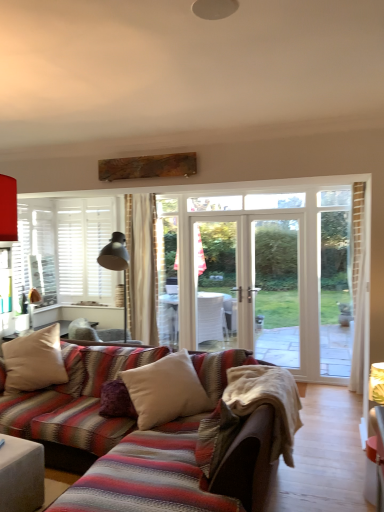
Image resolution: width=384 pixels, height=512 pixels. What do you see at coordinates (34, 361) in the screenshot? I see `beige fabric pillow at lower left, the third pillow from the right` at bounding box center [34, 361].

The width and height of the screenshot is (384, 512). What do you see at coordinates (116, 400) in the screenshot?
I see `velvet purple pillow at center, positioned as the second pillow in right-to-left order` at bounding box center [116, 400].

Measure the distance between white soft cushion at center, which ranks as the first pillow in right-to-left order, and camera.

They are 9.70 feet apart.

Identify the location of beige fabric pillow at lower left, the third pillow from the right. Image resolution: width=384 pixels, height=512 pixels. (34, 361).

Based on the photo, considering the positions of objects white soft cushion at center, which ranks as the first pillow in right-to-left order, and beige fabric pillow at lower left, which appears as the 1th pillow when viewed from the left, in the image provided, who is behind, white soft cushion at center, which ranks as the first pillow in right-to-left order, or beige fabric pillow at lower left, which appears as the 1th pillow when viewed from the left,?

beige fabric pillow at lower left, which appears as the 1th pillow when viewed from the left.

Which is more to the left, white soft cushion at center, the third pillow from the left, or beige fabric pillow at lower left, which appears as the 1th pillow when viewed from the left?

From the viewer's perspective, beige fabric pillow at lower left, which appears as the 1th pillow when viewed from the left, appears more on the left side.

Between point (191, 402) and point (44, 384), which one is positioned in front?

The point (191, 402) is closer.

How far apart are white soft cushion at center, the third pillow from the left, and beige fabric pillow at lower left, the third pillow from the right?

The distance of white soft cushion at center, the third pillow from the left, from beige fabric pillow at lower left, the third pillow from the right, is 1.06 meters.

Which of these two, velvet purple pillow at center, the second pillow when ordered from left to right, or beige cotton blanket at lower center, stands shorter?

With less height is velvet purple pillow at center, the second pillow when ordered from left to right.

Is velvet purple pillow at center, the second pillow when ordered from left to right, closer to camera compared to beige cotton blanket at lower center?

That is False.

Starting from the beige cotton blanket at lower center, which pillow is the 2nd one to the left? Please provide its 2D coordinates.

[(116, 400)]

From a real-world perspective, is velvet purple pillow at center, the second pillow when ordered from left to right, above or below beige cotton blanket at lower center?

velvet purple pillow at center, the second pillow when ordered from left to right, is below beige cotton blanket at lower center.

Which is in front, beige fabric pillow at lower left, which appears as the 1th pillow when viewed from the left, or white soft cushion at center, the third pillow from the left?

white soft cushion at center, the third pillow from the left.

Is beige fabric pillow at lower left, which appears as the 1th pillow when viewed from the left, spatially inside white soft cushion at center, the third pillow from the left, or outside of it?

beige fabric pillow at lower left, which appears as the 1th pillow when viewed from the left, lies outside white soft cushion at center, the third pillow from the left.

Between point (49, 358) and point (147, 416), which one is positioned in front?

The point (147, 416) is closer.

Is beige fabric pillow at lower left, the third pillow from the right, taller than white soft cushion at center, which ranks as the first pillow in right-to-left order?

Yes, beige fabric pillow at lower left, the third pillow from the right, is taller than white soft cushion at center, which ranks as the first pillow in right-to-left order.

Is the depth of beige fabric pillow at lower left, which appears as the 1th pillow when viewed from the left, less than that of velvet purple pillow at center, positioned as the second pillow in right-to-left order?

No, the depth of beige fabric pillow at lower left, which appears as the 1th pillow when viewed from the left, is greater than that of velvet purple pillow at center, positioned as the second pillow in right-to-left order.

Would you say beige fabric pillow at lower left, which appears as the 1th pillow when viewed from the left, is a long distance from velvet purple pillow at center, positioned as the second pillow in right-to-left order?

No, beige fabric pillow at lower left, which appears as the 1th pillow when viewed from the left, is not far from velvet purple pillow at center, positioned as the second pillow in right-to-left order.

Looking at this image, considering the sizes of objects beige fabric pillow at lower left, which appears as the 1th pillow when viewed from the left, and velvet purple pillow at center, positioned as the second pillow in right-to-left order, in the image provided, who is bigger, beige fabric pillow at lower left, which appears as the 1th pillow when viewed from the left, or velvet purple pillow at center, positioned as the second pillow in right-to-left order,?

beige fabric pillow at lower left, which appears as the 1th pillow when viewed from the left.

In order to click on the 2nd pillow positioned below the beige fabric pillow at lower left, which appears as the 1th pillow when viewed from the left (from the image's perspective) in this screenshot , I will do `click(116, 400)`.

Consider the image. From a real-world perspective, is beige cotton blanket at lower center below velvet purple pillow at center, positioned as the second pillow in right-to-left order?

No.

Is point (249, 379) closer to viewer compared to point (120, 405)?

Yes.

Which is correct: beige cotton blanket at lower center is inside velvet purple pillow at center, positioned as the second pillow in right-to-left order, or outside of it?

beige cotton blanket at lower center cannot be found inside velvet purple pillow at center, positioned as the second pillow in right-to-left order.

How different are the orientations of beige cotton blanket at lower center and velvet purple pillow at center, positioned as the second pillow in right-to-left order, in degrees?

beige cotton blanket at lower center and velvet purple pillow at center, positioned as the second pillow in right-to-left order, are facing 114 degrees away from each other.

Is beige cotton blanket at lower center completely or partially outside of beige fabric pillow at lower left, which appears as the 1th pillow when viewed from the left?

beige cotton blanket at lower center lies outside beige fabric pillow at lower left, which appears as the 1th pillow when viewed from the left,'s area.

Find the location of a particular element. blanket below the beige fabric pillow at lower left, the third pillow from the right (from the image's perspective) is located at coordinates (250, 413).

Which is closer, (247, 370) or (39, 374)?

Point (247, 370)

Considering the relative sizes of beige cotton blanket at lower center and beige fabric pillow at lower left, the third pillow from the right, in the image provided, is beige cotton blanket at lower center taller than beige fabric pillow at lower left, the third pillow from the right,?

Incorrect, the height of beige cotton blanket at lower center is not larger of that of beige fabric pillow at lower left, the third pillow from the right.

Do you think white soft cushion at center, the third pillow from the left, is within beige cotton blanket at lower center, or outside of it?

white soft cushion at center, the third pillow from the left, is located beyond the bounds of beige cotton blanket at lower center.

Which object is positioned more to the left, white soft cushion at center, which ranks as the first pillow in right-to-left order, or beige cotton blanket at lower center?

white soft cushion at center, which ranks as the first pillow in right-to-left order, is more to the left.

From a real-world perspective, is white soft cushion at center, the third pillow from the left, physically above beige cotton blanket at lower center?

Indeed, from a real-world perspective, white soft cushion at center, the third pillow from the left, stands above beige cotton blanket at lower center.

Looking at this image, which object is more forward, white soft cushion at center, the third pillow from the left, or beige cotton blanket at lower center?

beige cotton blanket at lower center.

Where is `pillow that is the 2nd object to the right of the beige fabric pillow at lower left, which appears as the 1th pillow when viewed from the left, starting at the anchor`? The height and width of the screenshot is (512, 384). pillow that is the 2nd object to the right of the beige fabric pillow at lower left, which appears as the 1th pillow when viewed from the left, starting at the anchor is located at coordinates (165, 390).

Locate an element on the screen. pillow below the beige cotton blanket at lower center (from the image's perspective) is located at coordinates coord(116,400).

Considering their positions, is matte gray ottoman at lower left positioned closer to velvet purple pillow at center, positioned as the second pillow in right-to-left order, than white soft cushion at center, the third pillow from the left?

white soft cushion at center, the third pillow from the left.

Looking at the image, which one is located further to matte gray ottoman at lower left, beige fabric pillow at lower left, the third pillow from the right, or white soft cushion at center, the third pillow from the left?

beige fabric pillow at lower left, the third pillow from the right.

Consider the image. Considering their positions, is beige fabric pillow at lower left, which appears as the 1th pillow when viewed from the left, positioned closer to beige cotton blanket at lower center than white soft cushion at center, the third pillow from the left?

Based on the image, white soft cushion at center, the third pillow from the left, appears to be nearer to beige cotton blanket at lower center.

From the image, which object appears to be farther from beige cotton blanket at lower center, beige fabric pillow at lower left, which appears as the 1th pillow when viewed from the left, or matte gray ottoman at lower left?

Among the two, beige fabric pillow at lower left, which appears as the 1th pillow when viewed from the left, is located further to beige cotton blanket at lower center.

From the image, which object appears to be farther from beige fabric pillow at lower left, the third pillow from the right, white soft cushion at center, which ranks as the first pillow in right-to-left order, or matte gray ottoman at lower left?

Among the two, matte gray ottoman at lower left is located further to beige fabric pillow at lower left, the third pillow from the right.

From the image, which object appears to be nearer to white soft cushion at center, the third pillow from the left, beige fabric pillow at lower left, the third pillow from the right, or beige cotton blanket at lower center?

The object closer to white soft cushion at center, the third pillow from the left, is beige cotton blanket at lower center.

Estimate the real-world distances between objects in this image. Which object is further from velvet purple pillow at center, positioned as the second pillow in right-to-left order, beige fabric pillow at lower left, which appears as the 1th pillow when viewed from the left, or beige cotton blanket at lower center?

The object further to velvet purple pillow at center, positioned as the second pillow in right-to-left order, is beige cotton blanket at lower center.

Looking at the image, which one is located further to matte gray ottoman at lower left, beige cotton blanket at lower center or white soft cushion at center, the third pillow from the left?

The object further to matte gray ottoman at lower left is beige cotton blanket at lower center.

Identify the location of pillow situated between velvet purple pillow at center, the second pillow when ordered from left to right, and beige cotton blanket at lower center from left to right. (165, 390).

The width and height of the screenshot is (384, 512). What are the coordinates of `table located between beige fabric pillow at lower left, which appears as the 1th pillow when viewed from the left, and beige cotton blanket at lower center in the left-right direction` in the screenshot? It's located at (21, 475).

Find the location of a particular element. pillow between beige fabric pillow at lower left, the third pillow from the right, and white soft cushion at center, the third pillow from the left, from left to right is located at coordinates (116, 400).

This screenshot has width=384, height=512. Find the location of `table located between beige fabric pillow at lower left, which appears as the 1th pillow when viewed from the left, and white soft cushion at center, the third pillow from the left, in the left-right direction`. table located between beige fabric pillow at lower left, which appears as the 1th pillow when viewed from the left, and white soft cushion at center, the third pillow from the left, in the left-right direction is located at coordinates (21, 475).